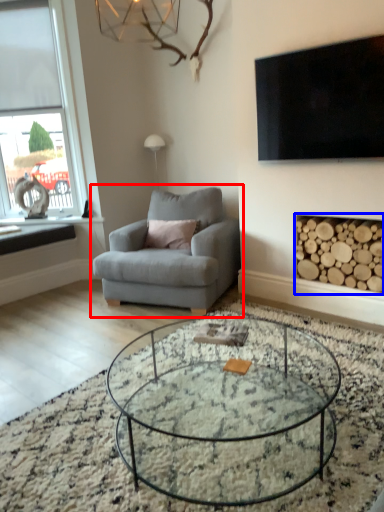
Question: Which object is closer to the camera taking this photo, chair (highlighted by a red box) or fireplace (highlighted by a blue box)?

Choices:
 (A) chair
 (B) fireplace

Answer: (B)